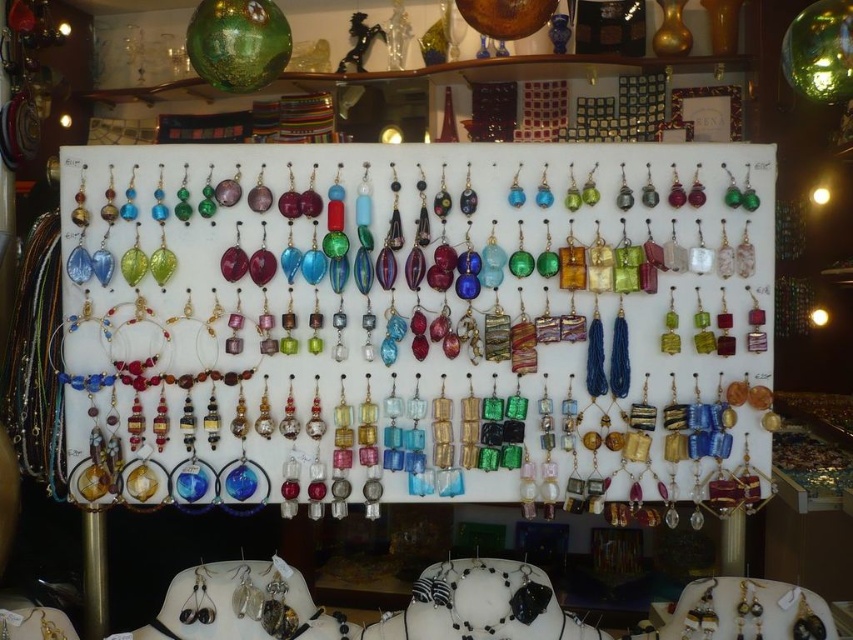
Consider the image. You are a customer at a jewelry store and want to buy an earring and a necklace. You notice the translucent glass earrings at center and the gold metallic necklace at lower left. Which one is taller?

The translucent glass earrings at center is much taller than the gold metallic necklace at lower left.

Looking at this image, you are a customer at a jewelry store and want to place a small gift box between the translucent glass earrings at center and the gold metallic necklace at lower left. The gift box is 25 inches long. Will it fit between them?

The distance between the translucent glass earrings at center and the gold metallic necklace at lower left is 25.82 inches. Since the gift box is 25 inches long, it will fit between them with a small amount of space remaining.

You are a customer at a jewelry store and want to choose between the translucent glass earrings at center and the gold metallic necklace at lower left. If you prefer a larger piece, which one should you choose?

The translucent glass earrings at center is bigger than the gold metallic necklace at lower left, so you should choose the translucent glass earrings at center if you prefer a larger piece.